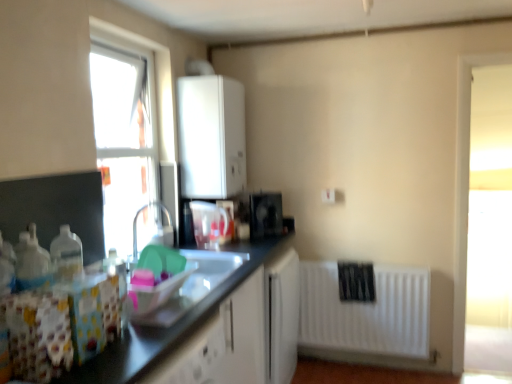
Question: Is point (108, 72) positioned closer to the camera than point (200, 244)?

Choices:
 (A) farther
 (B) closer

Answer: (B)

Question: Looking at the image, does transparent glass window at upper left seem bigger or smaller compared to translucent plastic container at center, the first appliance when ordered from front to back?

Choices:
 (A) big
 (B) small

Answer: (A)

Question: Estimate the real-world distances between objects in this image. Which object is farther from the white matte radiator at lower right?

Choices:
 (A) transparent glass window at upper left
 (B) white matte boiler at upper center
 (C) black plastic toaster at upper center, which is the first appliance from back to front
 (D) translucent plastic container at center, which is counted as the 2th appliance, starting from the back
 (E) shiny plastic containers at lower left

Answer: (A)

Question: Estimate the real-world distances between objects in this image. Which object is farther from the black plastic toaster at upper center, the 2th appliance from the front?

Choices:
 (A) white matte boiler at upper center
 (B) transparent glass window at upper left
 (C) white matte radiator at lower right
 (D) translucent plastic container at center, which is counted as the 2th appliance, starting from the back
 (E) shiny plastic containers at lower left

Answer: (B)